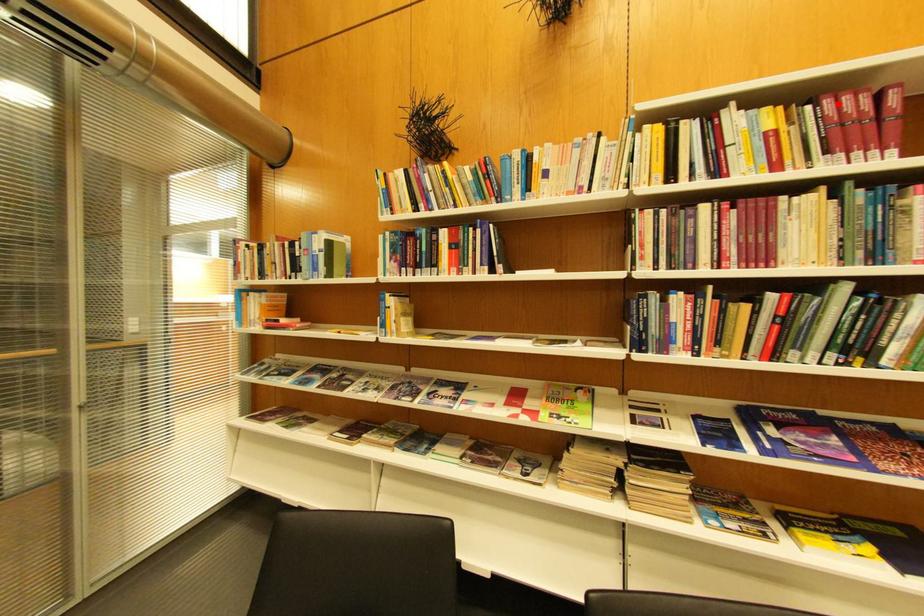
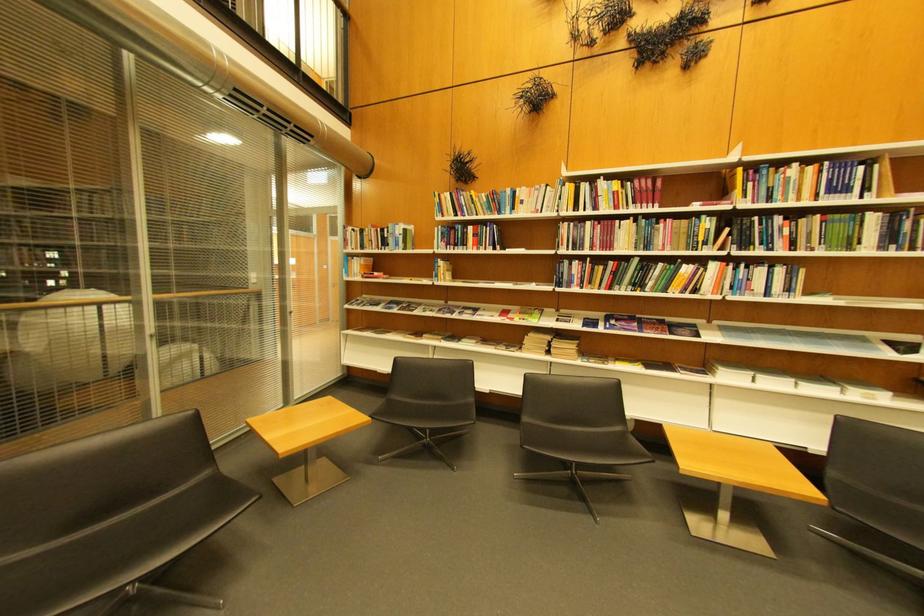
Question: I am providing you with two images of the same scene from different viewpoints. Image1 has a red point marked. In image2, the corresponding 3D location appears at what relative position? Reply with the corresponding letter.

Choices:
 (A) Closer
 (B) Farther

Answer: (A)